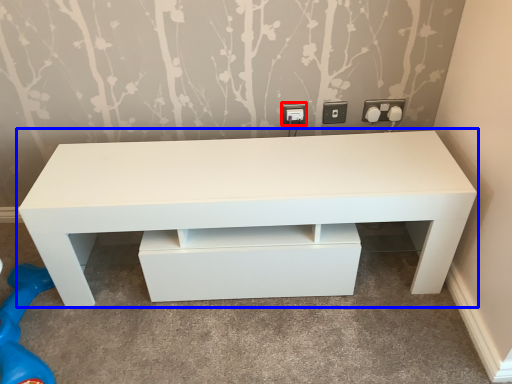
Question: Which object appears farthest to the camera in this image, electric outlet (highlighted by a red box) or table (highlighted by a blue box)?

Choices:
 (A) electric outlet
 (B) table

Answer: (A)